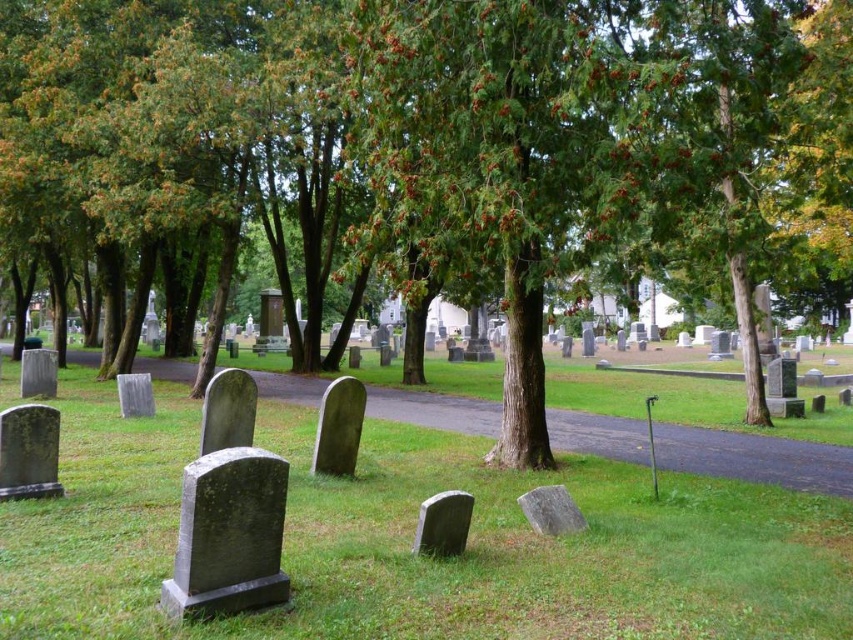
You are a gardener who needs to mow the lawn in the cemetery. You see the green grassy at center and the black stone gravestone at lower left. Which area should you avoid mowing to prevent damaging the gravestone?

You should avoid mowing the area around the black stone gravestone at lower left to prevent damaging it, as the green grassy at center is the larger area that needs mowing.

You are a gardener with a 2.5 meter long hose. You need to water the green grassy at center from your current position near the black stone gravestone at lower left. Can you reach the grassy area without moving the hose? Please explain.

The distance between the green grassy at center and the black stone gravestone at lower left is 1.98 meters. Since the hose is 2.5 meters long, which is longer than the distance, you can reach the green grassy at center without moving the hose.